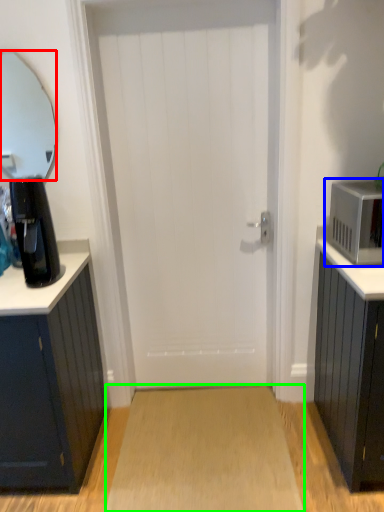
Question: Estimate the real-world distances between objects in this image. Which object is farther from mirror (highlighted by a red box), microwave oven (highlighted by a blue box) or plain (highlighted by a green box)?

Choices:
 (A) microwave oven
 (B) plain

Answer: (A)